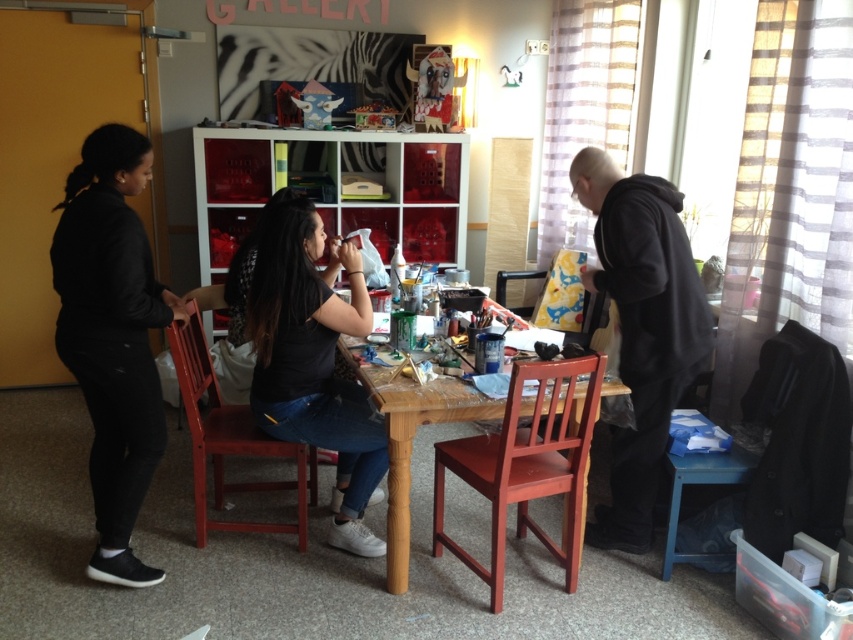
Question: Is black matte shirt at center below satin wood chair at center?

Choices:
 (A) yes
 (B) no

Answer: (B)

Question: Is satin wood chair at center to the left of matte wood chair at center from the viewer's perspective?

Choices:
 (A) no
 (B) yes

Answer: (A)

Question: Which of the following is the closest to the observer?

Choices:
 (A) (235, 449)
 (B) (621, 218)

Answer: (B)

Question: Estimate the real-world distances between objects in this image. Which object is farther from the black matte shirt at center?

Choices:
 (A) satin wood chair at center
 (B) black hoodie at right

Answer: (B)

Question: Can you confirm if black hoodie at right is positioned to the left of wooden table at center?

Choices:
 (A) yes
 (B) no

Answer: (B)

Question: Estimate the real-world distances between objects in this image. Which object is farther from the matte wood chair at center?

Choices:
 (A) satin wood chair at center
 (B) black matte pants at left
 (C) wooden table at center

Answer: (A)